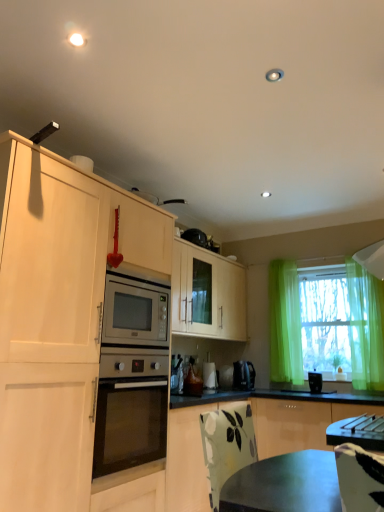
Question: Is green matte cabinet at lower right inside the boundaries of translucent green curtain at right, or outside?

Choices:
 (A) outside
 (B) inside

Answer: (A)

Question: In terms of width, does green matte cabinet at lower right look wider or thinner when compared to translucent green curtain at right?

Choices:
 (A) wide
 (B) thin

Answer: (A)

Question: Which object is positioned farthest from the green matte cabinet at lower right?

Choices:
 (A) white glossy coffee maker at lower center, which is the 2th appliance from right to left
 (B) black plastic coffee maker at center
 (C) translucent green curtain at right
 (D) black plastic toaster at right, the third appliance from the back
 (E) green sheer curtain at right

Answer: (B)

Question: Which is farther from the green sheer curtain at right?

Choices:
 (A) translucent green curtain at right
 (B) metallic silver toaster at center, which is counted as the first appliance, starting from the left
 (C) green matte cabinet at lower right
 (D) black plastic coffee maker at center
 (E) white glossy coffee maker at lower center, the third appliance in the front-to-back sequence

Answer: (B)